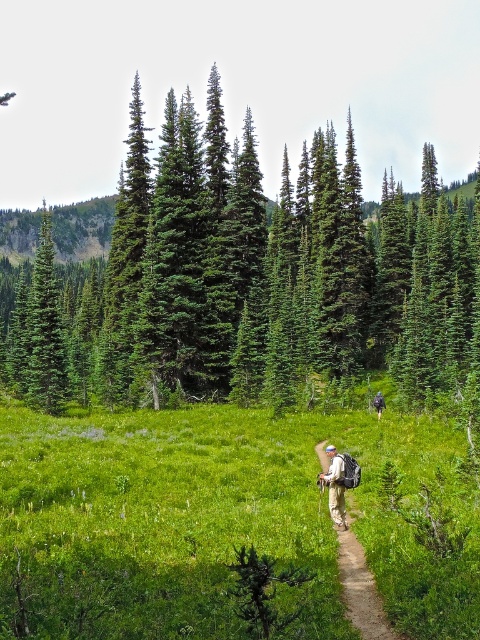
Between green evergreen tree at center and camouflage backpack at center, which one is positioned higher?

green evergreen tree at center is higher up.

Who is positioned more to the left, green evergreen tree at center or camouflage backpack at center?

green evergreen tree at center

Is point (210, 328) more distant than point (379, 401)?

Yes, it is.

At what (x,y) coordinates should I click in order to perform the action: click on green evergreen tree at center. Please return your answer as a coordinate pair (x, y). The height and width of the screenshot is (640, 480). Looking at the image, I should click on (271, 273).

Does green evergreen tree at center appear on the right side of tan fabric backpack at center?

In fact, green evergreen tree at center is to the left of tan fabric backpack at center.

Is green evergreen tree at center positioned at the back of tan fabric backpack at center?

Yes, it is.

The image size is (480, 640). In order to click on green evergreen tree at center in this screenshot , I will do `click(271, 273)`.

Who is more forward, (339,497) or (377,403)?

Point (339,497)

Consider the image. Which of these two, khaki cotton pants at center or camouflage backpack at center, stands shorter?

With less height is camouflage backpack at center.

Identify the location of khaki cotton pants at center. (335, 486).

Find the location of a particular element. This screenshot has height=640, width=480. khaki cotton pants at center is located at coordinates (335, 486).